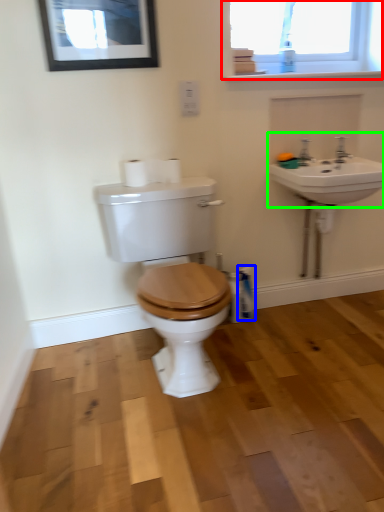
Question: Which object is the farthest from window (highlighted by a red box)? Choose among these: cleaning product (highlighted by a blue box) or sink (highlighted by a green box).

Choices:
 (A) cleaning product
 (B) sink

Answer: (A)